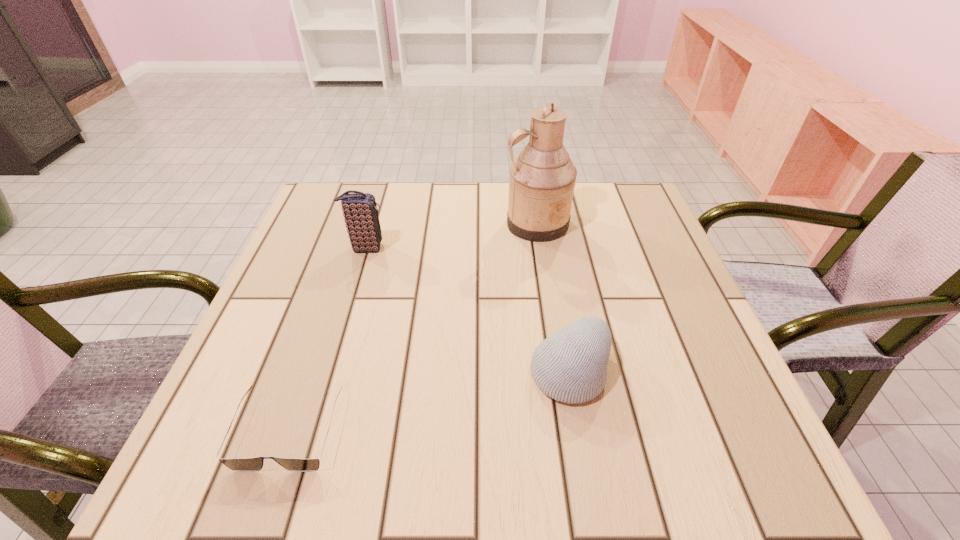
This screenshot has height=540, width=960. What are the coordinates of `pitcher` in the screenshot? It's located at (542, 178).

Find the location of a particular element. The image size is (960, 540). clutch bag is located at coordinates (360, 212).

Image resolution: width=960 pixels, height=540 pixels. Identify the location of the second shortest object. (570, 366).

Identify the location of the shortest object. (243, 464).

The height and width of the screenshot is (540, 960). Find the location of `free space located on the left of the pitcher`. free space located on the left of the pitcher is located at coordinates (348, 224).

Where is `vacant space situated with the zip open on the second tallest object`? vacant space situated with the zip open on the second tallest object is located at coordinates (432, 248).

This screenshot has height=540, width=960. What are the coordinates of `vacant space located 0.380m on the back of the beanie` in the screenshot? It's located at (543, 223).

Find the location of a particular element. Image resolution: width=960 pixels, height=540 pixels. object at the far edge is located at coordinates (542, 178).

Locate an element on the screen. Image resolution: width=960 pixels, height=540 pixels. object that is at the near edge is located at coordinates (243, 464).

Identify the location of clutch bag present at the left edge. This screenshot has height=540, width=960. (360, 212).